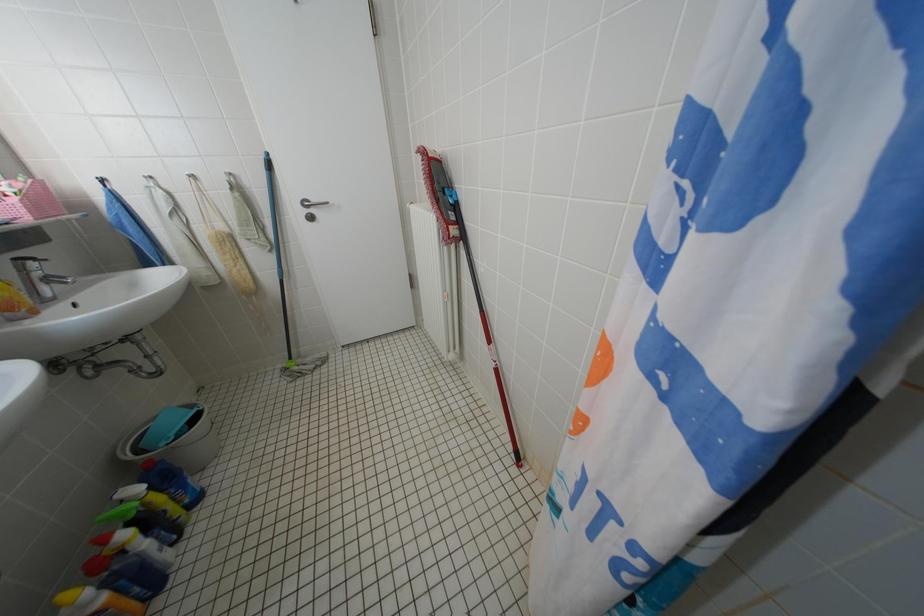
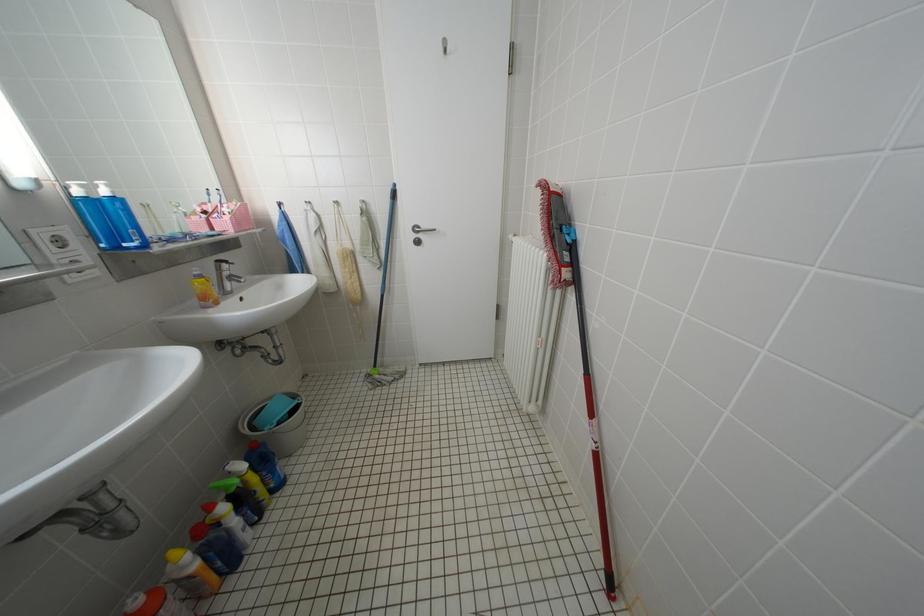
In a continuous first-person perspective shot, in which direction is the camera moving?

The movement direction of the cameraman is left, forward.